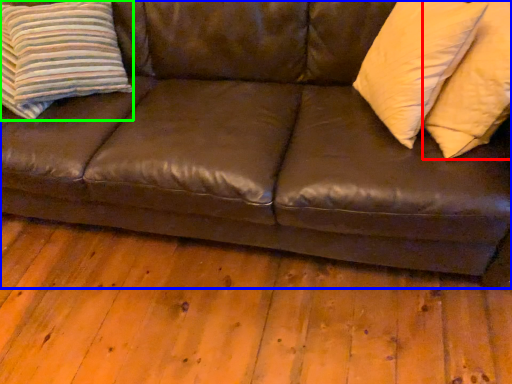
Question: Which object is positioned closest to pillow (highlighted by a red box)? Select from studio couch (highlighted by a blue box) and pillow (highlighted by a green box).

Choices:
 (A) studio couch
 (B) pillow

Answer: (A)